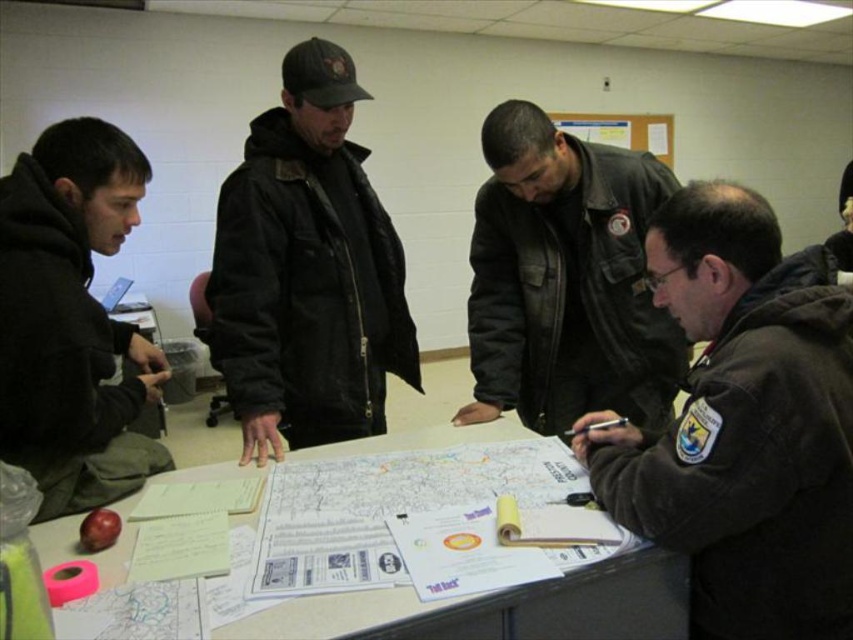
You are standing in the room and want to place a small object on the white paper at center. Where should you aim to place it?

You should aim for the coordinates point (494, 609) where the white paper at center is located.

You are a delivery person who needs to place a package between the matte black jacket at center and the wooden noticeboard at upper center. The package requires a space of 4 meters. Is there enough space between them?

The distance between the matte black jacket at center and the wooden noticeboard at upper center is 4.13 meters, which is sufficient to accommodate the 4 meter package. Yes, there is enough space.

You are a new member joining this meeting and need to choose a seat. There are two options available next to the matte black jacket at center and the wooden noticeboard at upper center. Considering their sizes, which seat would you choose if you want more personal space?

The wooden noticeboard at upper center is larger than the matte black jacket at center, so choosing the seat next to the wooden noticeboard at upper center would provide more personal space since it occupies a bigger area.